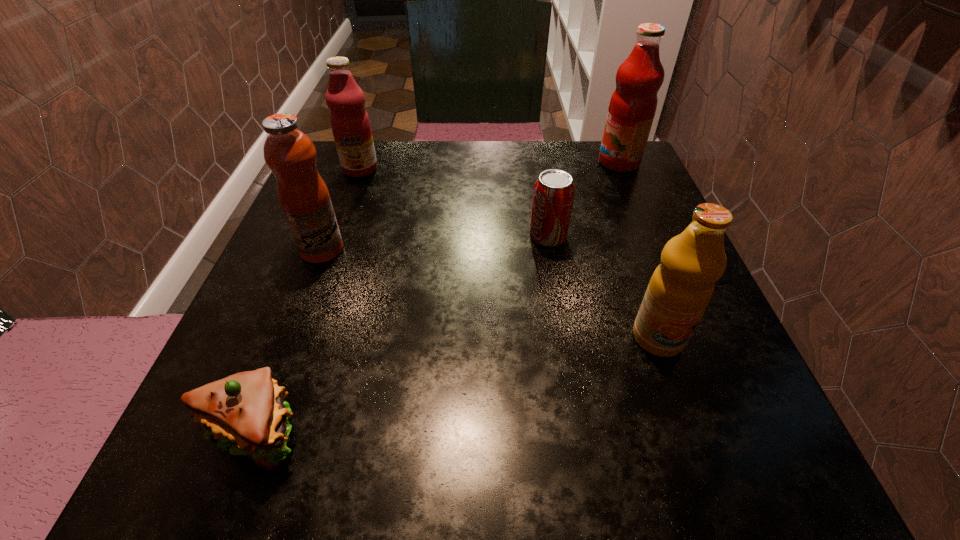
Identify the location of the second nearest fruit juice. (289, 153).

Find the location of a particular element. the fifth farthest object is located at coordinates (681, 287).

Image resolution: width=960 pixels, height=540 pixels. Find the location of `the third object from right to left`. the third object from right to left is located at coordinates (553, 194).

Locate an element on the screen. The width and height of the screenshot is (960, 540). the nearest object is located at coordinates (246, 411).

I want to click on vacant area situated on the front label of the second nearest fruit juice, so click(381, 249).

You are a GUI agent. You are given a task and a screenshot of the screen. Output one action in this format:
    pyautogui.click(x=<x>, y=<y>)
    Task: Click on the vacant space located on the front label of the nearest fruit juice
    
    Given the screenshot: What is the action you would take?
    pyautogui.click(x=679, y=396)

Identify the location of blank area located 0.270m on the back of the soda can. This screenshot has width=960, height=540. (534, 156).

Find the location of a particular element. Image resolution: width=960 pixels, height=540 pixels. free space located on the right of the nearest object is located at coordinates (500, 433).

Find the location of a particular element. Image resolution: width=960 pixels, height=540 pixels. object at the near edge is located at coordinates (246, 411).

Locate an element on the screen. The image size is (960, 540). sandwich at the left edge is located at coordinates (246, 411).